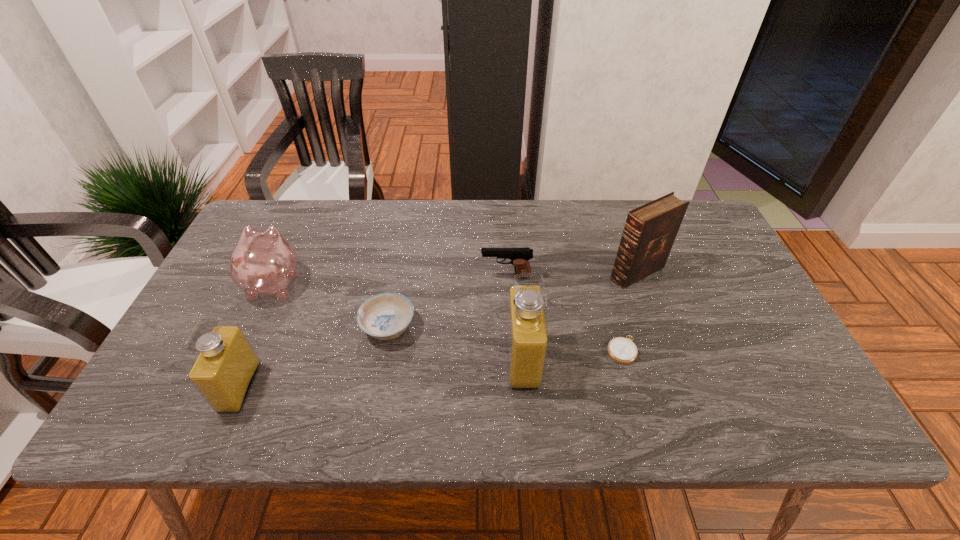
The image size is (960, 540). What are the coordinates of `the fifth shortest object` in the screenshot? It's located at (223, 372).

Locate an element on the screen. the left perfume is located at coordinates (223, 372).

The height and width of the screenshot is (540, 960). In order to click on the taller perfume in this screenshot , I will do `click(527, 338)`.

What are the coordinates of `the fifth tallest object` in the screenshot? It's located at (519, 257).

Where is `Bible`? Bible is located at coordinates (650, 230).

Locate an element on the screen. The image size is (960, 540). the second shortest object is located at coordinates (384, 316).

This screenshot has width=960, height=540. Find the location of `the third object from left to right`. the third object from left to right is located at coordinates (384, 316).

Find the location of `the fourth shortest object`. the fourth shortest object is located at coordinates (262, 262).

Identify the location of compass. (622, 350).

You are a GUI agent. You are given a task and a screenshot of the screen. Output one action in this format:
    pyautogui.click(x=<x>, y=<y>)
    Task: Click on the vacant space situated on the front-facing side of the left perfume
    
    Given the screenshot: What is the action you would take?
    pyautogui.click(x=275, y=387)